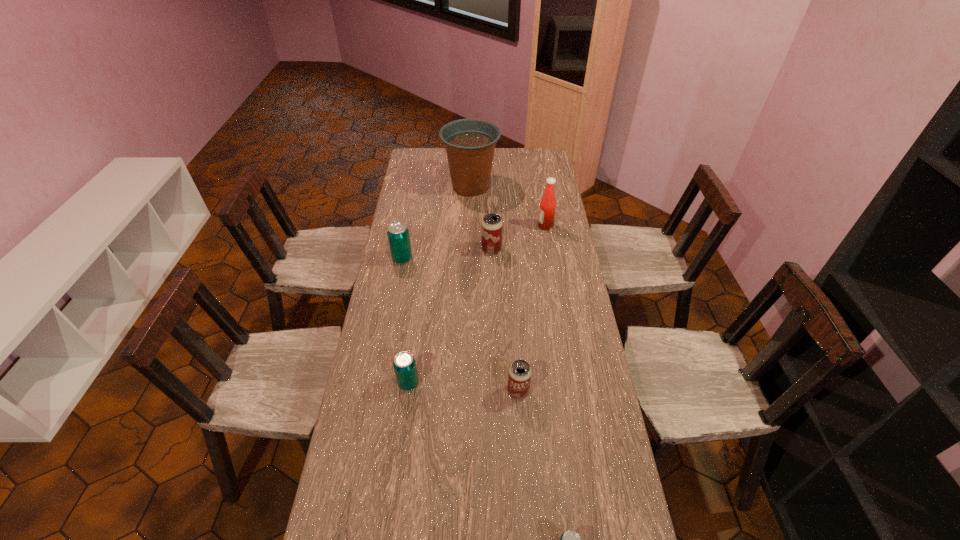
Find the location of `free location at the right edge of the desktop`. free location at the right edge of the desktop is located at coordinates (541, 298).

At what (x,y) coordinates should I click in order to perform the action: click on vacant area at the far left corner of the desktop. Please return your answer as a coordinate pair (x, y). The width and height of the screenshot is (960, 540). Looking at the image, I should click on (427, 150).

Find the location of `free space between the leftmost object and the farther red beer can`. free space between the leftmost object and the farther red beer can is located at coordinates (446, 254).

Identify the location of empty space that is in between the smaller red beer can and the leftmost teal beer can. tap(460, 325).

Image resolution: width=960 pixels, height=540 pixels. What are the coordinates of `vacant area between the sixth object from right to left and the tallest object` in the screenshot? It's located at (440, 285).

This screenshot has width=960, height=540. In order to click on vacant region between the tallest object and the second teal beer can from left to right in this screenshot , I will do `click(440, 285)`.

The width and height of the screenshot is (960, 540). In order to click on object that is the fifth closest to the nearest beer can in this screenshot , I will do point(546,216).

In order to click on the sixth closest object relative to the farthest object in this screenshot , I will do `click(569, 539)`.

Find the location of `beer can identified as the closest to the second farthest object`. beer can identified as the closest to the second farthest object is located at coordinates (491, 226).

Locate an element on the screen. Image resolution: width=960 pixels, height=540 pixels. the closest beer can to the flowerpot is located at coordinates (491, 226).